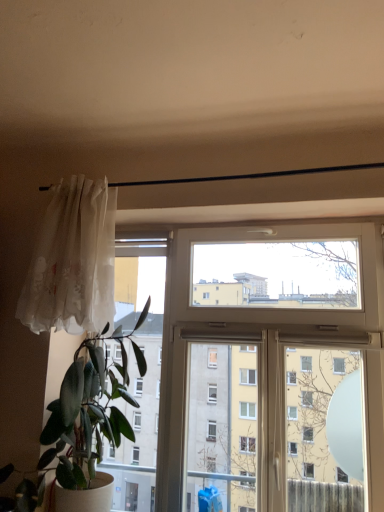
Question: Considering their positions, is green matte plant at left located in front of or behind translucent white curtain at left?

Choices:
 (A) front
 (B) behind

Answer: (A)

Question: Is point (59, 444) closer or farther from the camera than point (72, 293)?

Choices:
 (A) farther
 (B) closer

Answer: (B)

Question: Based on their relative distances, which object is farther from the translucent white curtain at left?

Choices:
 (A) white plastic window at center
 (B) green matte plant at left

Answer: (A)

Question: Which object is the farthest from the translucent white curtain at left?

Choices:
 (A) white plastic window at center
 (B) green matte plant at left

Answer: (A)